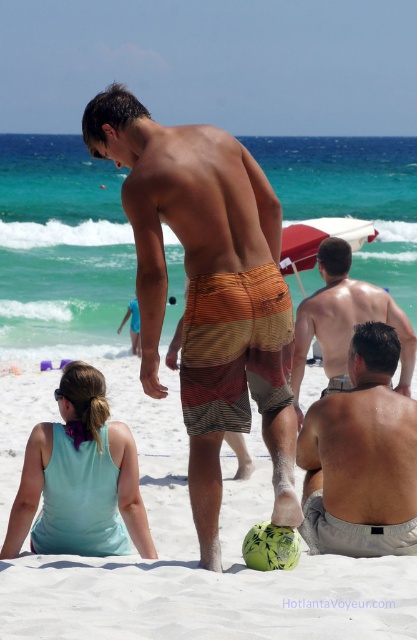
In the scene shown: You are a photographer trying to capture a shot of the striped cotton shorts at center and the green textured ball at center. If you want to include both in your frame, which object should you position closer to the left side of your camera?

The green textured ball at center should be positioned closer to the left side of your camera since it is located to the left of the striped cotton shorts at center.